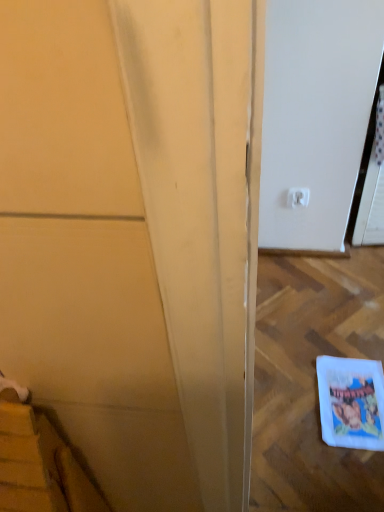
This screenshot has width=384, height=512. I want to click on free point below white paper comic book at lower right (from a real-world perspective), so click(357, 401).